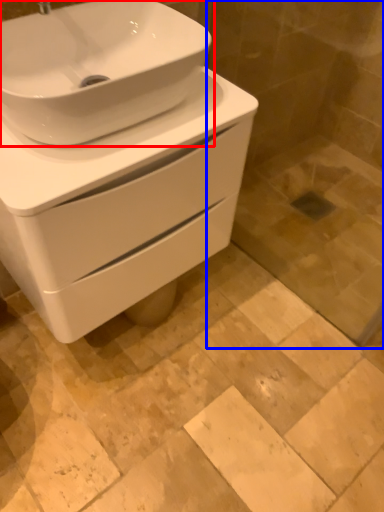
Question: Which object appears farthest to the camera in this image, sink (highlighted by a red box) or glass door (highlighted by a blue box)?

Choices:
 (A) sink
 (B) glass door

Answer: (B)